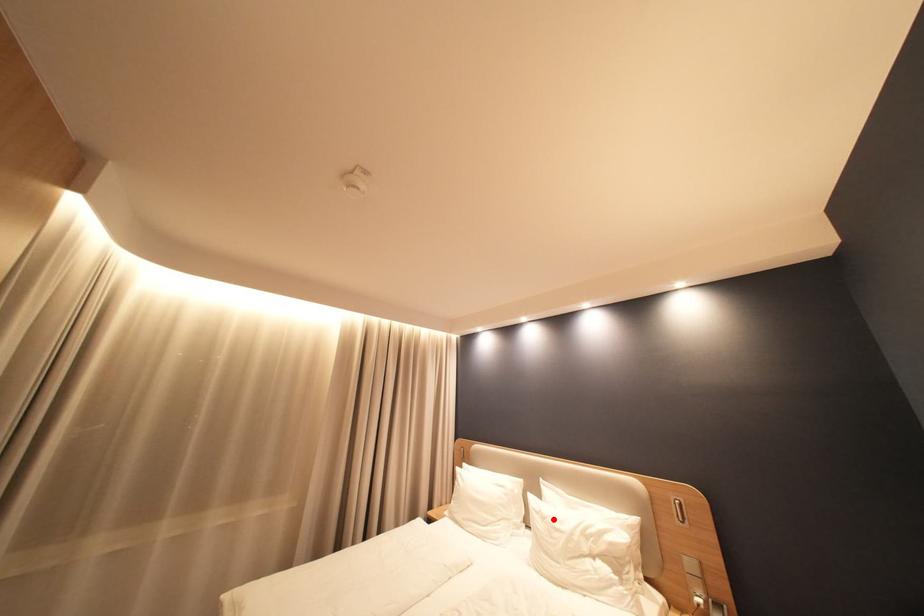
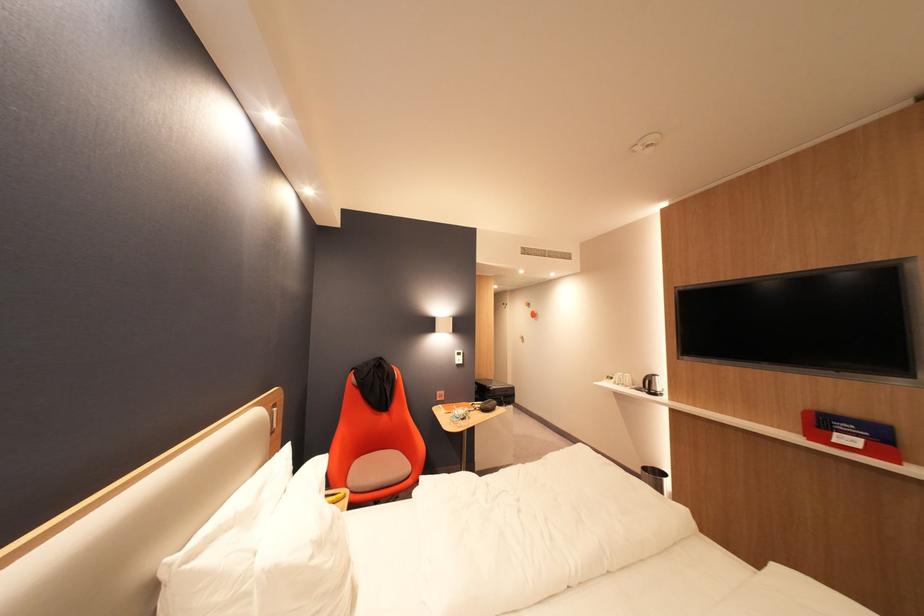
Question: I am providing you with two images of the same scene from different viewpoints. A red point is shown in image1. For the corresponding object point in image2, is it positioned nearer or farther from the camera?

Choices:
 (A) Nearer
 (B) Farther

Answer: (A)